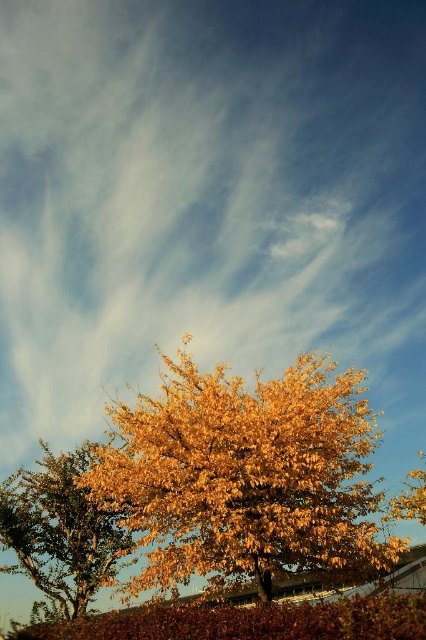
Is golden leafy tree at center smaller than golden textured leaves at lower left?

Yes.

Where is `golden leafy tree at center`? golden leafy tree at center is located at coordinates (x=244, y=476).